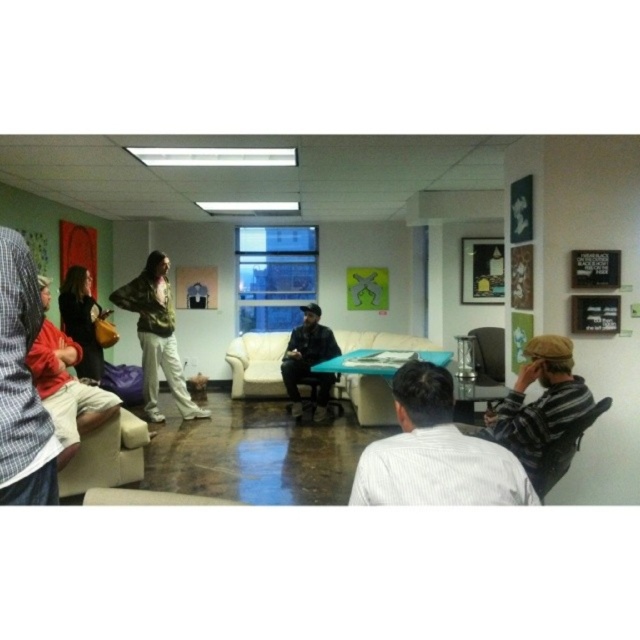
Question: Can you confirm if beige fabric chair at lower left is positioned below dark blue jeans at center?

Choices:
 (A) yes
 (B) no

Answer: (A)

Question: Considering the real-world distances, which object is closest to the matte brown jacket at left?

Choices:
 (A) dark blue jeans at center
 (B) matte black jacket at left
 (C) white leather couch at center
 (D) beige fabric chair at lower left

Answer: (D)

Question: Observing the image, what is the correct spatial positioning of plaid shirt at left in reference to matte black jacket at left?

Choices:
 (A) above
 (B) below

Answer: (A)

Question: Is plaid shirt at left bigger than metallic silver chair at lower right?

Choices:
 (A) yes
 (B) no

Answer: (B)

Question: Which object appears farthest from the camera in this image?

Choices:
 (A) white leather couch at center
 (B) matte brown jacket at left

Answer: (A)

Question: Which of the following is the farthest from the observer?

Choices:
 (A) (186, 413)
 (B) (460, 419)
 (C) (90, 355)
 (D) (289, 372)

Answer: (D)